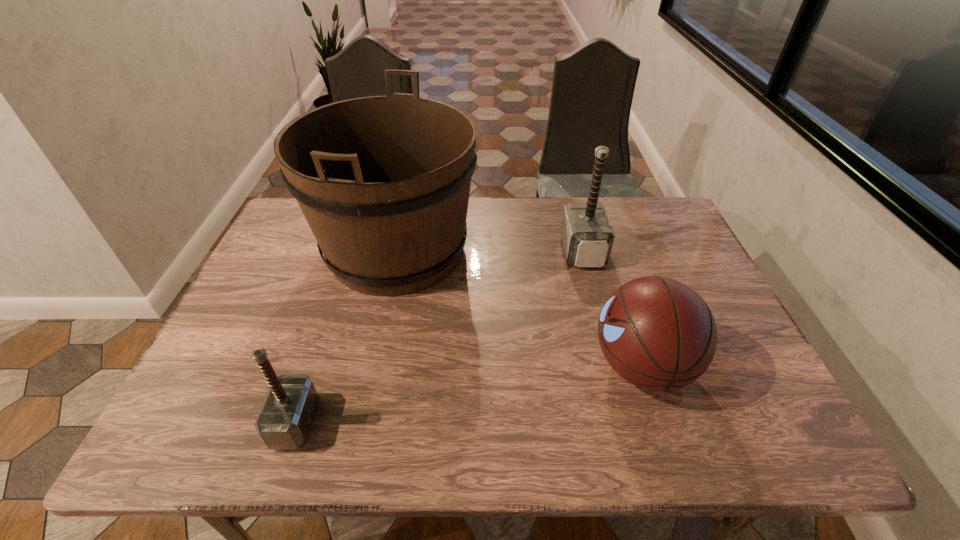
The height and width of the screenshot is (540, 960). In the image, there is a desktop. Find the location of `vacant space at the far edge`. vacant space at the far edge is located at coordinates (551, 213).

Locate an element on the screen. The height and width of the screenshot is (540, 960). free space at the left edge is located at coordinates pyautogui.click(x=274, y=353).

In the image, there is a desktop. Identify the location of vacant space at the right edge. (674, 254).

This screenshot has height=540, width=960. In the image, there is a desktop. What are the coordinates of `vacant space at the near left corner` in the screenshot? It's located at (226, 416).

This screenshot has height=540, width=960. Find the location of `free space at the far right corner`. free space at the far right corner is located at coordinates (639, 222).

Identify the location of empty location between the tallest object and the nearer hammer. The image size is (960, 540). (346, 336).

You are a GUI agent. You are given a task and a screenshot of the screen. Output one action in this format:
    pyautogui.click(x=<x>, y=<y>)
    Task: Click on the empty space between the basketball and the shorter hammer
    The width and height of the screenshot is (960, 540).
    Given the screenshot: What is the action you would take?
    pyautogui.click(x=468, y=394)

I want to click on empty space that is in between the tallest object and the nearer hammer, so click(346, 336).

The image size is (960, 540). I want to click on free spot between the shorter hammer and the tallest object, so click(x=346, y=336).

Find the location of a particular element. This screenshot has width=960, height=540. vacant space in between the bucket and the shorter hammer is located at coordinates (346, 336).